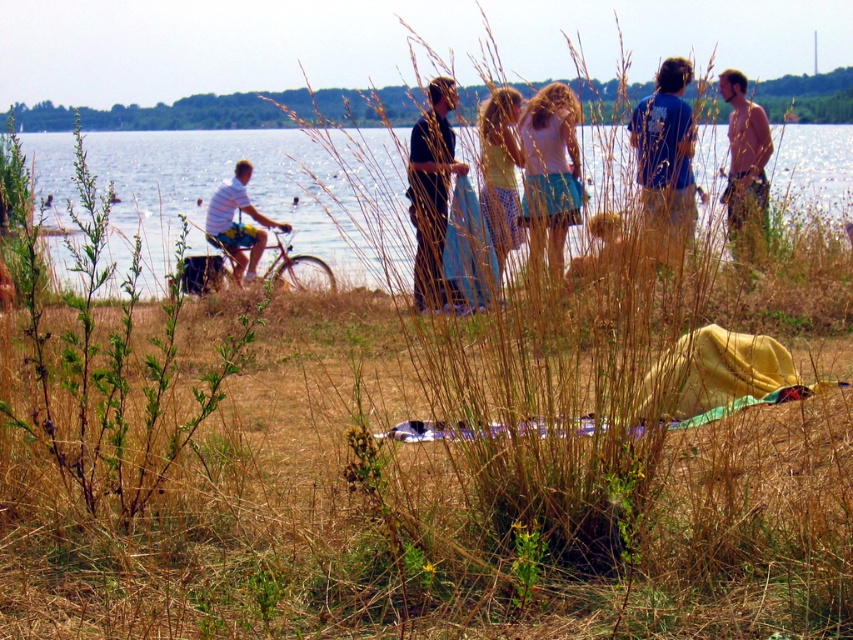
Who is higher up, clear blue water at center or shiny brown hair at right?

shiny brown hair at right is above.

Is point (149, 216) closer to viewer compared to point (743, 115)?

No.

Which is behind, point (55, 268) or point (750, 144)?

Point (750, 144)

What are the coordinates of `clear blue water at center` in the screenshot? It's located at (264, 193).

Is shiny brown hair at right thinner than white matte shirt at left?

Indeed, shiny brown hair at right has a lesser width compared to white matte shirt at left.

Is point (732, 164) more distant than point (222, 211)?

No, (732, 164) is closer to viewer.

The height and width of the screenshot is (640, 853). I want to click on shiny brown hair at right, so click(746, 168).

What are the coordinates of `shiny brown hair at right` in the screenshot? It's located at (746, 168).

Which of these two, shiny brown hair at right or blonde hair at center, stands shorter?

With less height is blonde hair at center.

Is point (761, 252) less distant than point (614, 220)?

No, it is not.

Does point (728, 99) lie in front of point (608, 243)?

No, it is not.

Find the location of a particular element. The width and height of the screenshot is (853, 640). shiny brown hair at right is located at coordinates (746, 168).